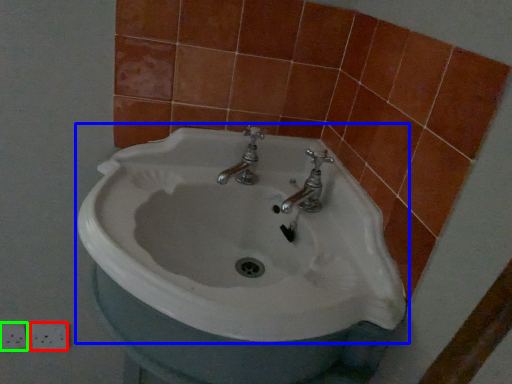
Question: Which object is the closest to the ceramic tile (highlighted by a red box)? Choose among these: sink (highlighted by a blue box) or ceramic tile (highlighted by a green box).

Choices:
 (A) sink
 (B) ceramic tile

Answer: (B)